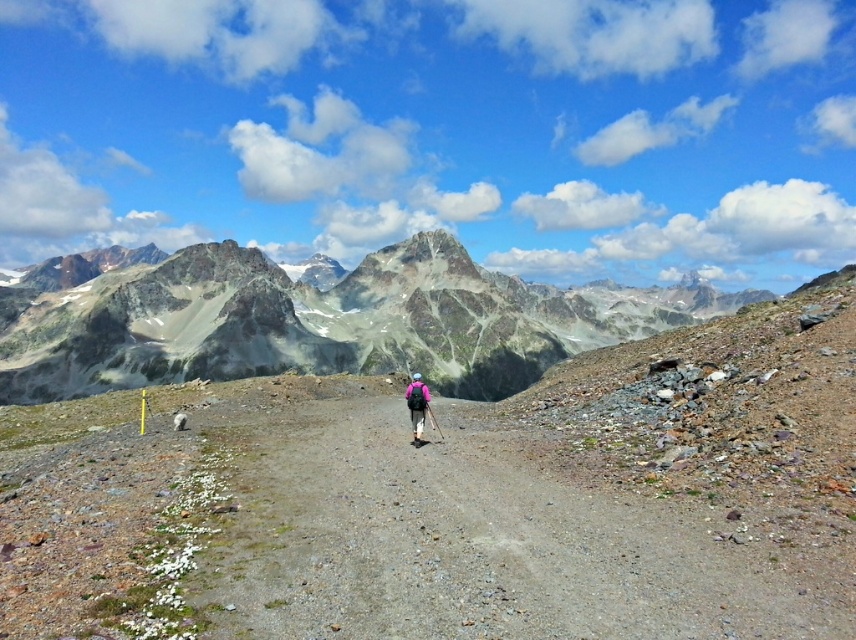
Question: Can you confirm if brown gravel path at center is positioned below rocky snow-capped mountains at center?

Choices:
 (A) yes
 (B) no

Answer: (A)

Question: Which object is closer to the camera taking this photo?

Choices:
 (A) brown gravel path at center
 (B) rocky snow-capped mountains at center
 (C) pink fabric backpack at center

Answer: (A)

Question: Among these points, which one is nearest to the camera?

Choices:
 (A) (236, 541)
 (B) (409, 385)

Answer: (A)

Question: Is brown gravel path at center further to the viewer compared to rocky snow-capped mountains at center?

Choices:
 (A) no
 (B) yes

Answer: (A)

Question: Is brown gravel path at center positioned in front of rocky snow-capped mountains at center?

Choices:
 (A) no
 (B) yes

Answer: (B)

Question: Which point is farther from the camera taking this photo?

Choices:
 (A) (421, 392)
 (B) (383, 564)
 (C) (501, 291)

Answer: (C)